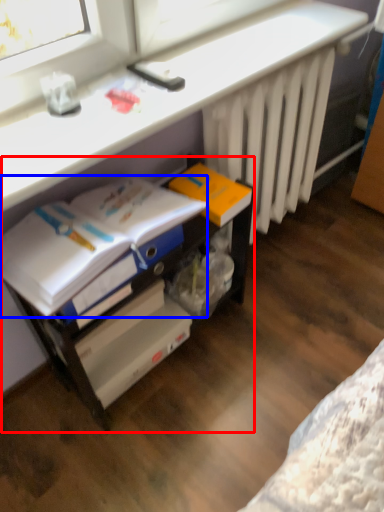
Question: Among these objects, which one is nearest to the camera, file cabinet (highlighted by a red box) or magazine (highlighted by a blue box)?

Choices:
 (A) file cabinet
 (B) magazine

Answer: (B)